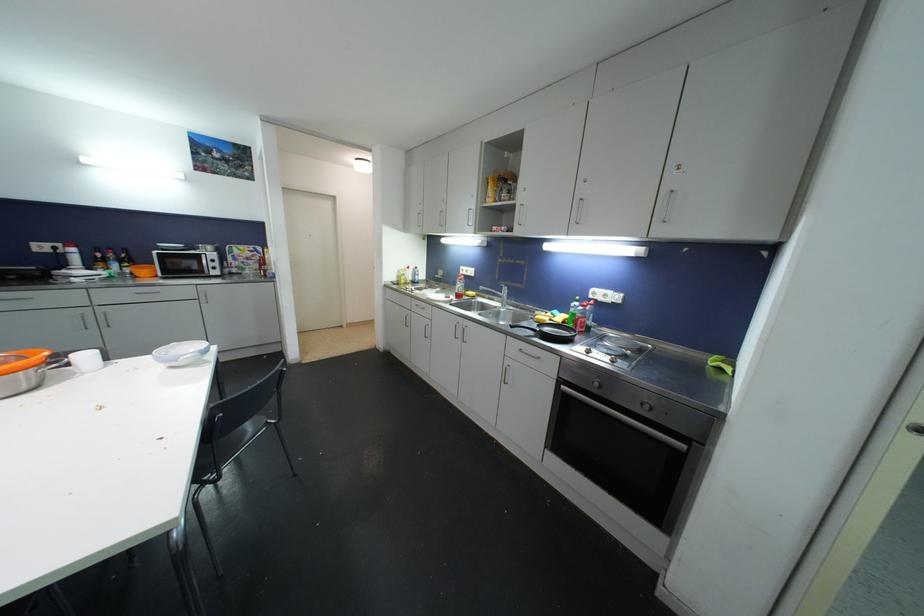
The width and height of the screenshot is (924, 616). I want to click on silver faucet handle, so click(503, 282).